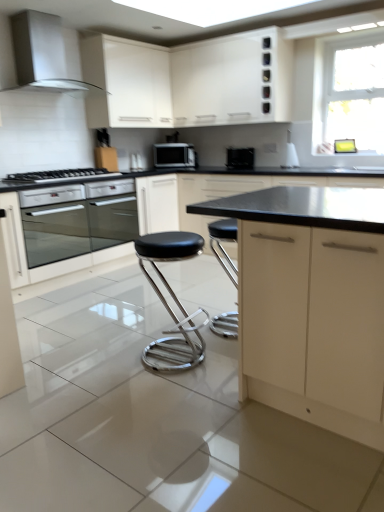
Question: Relative to black matte cabinet at center, positioned as the 2th cabinetry in bottom-to-top order, is satin silver range hood at upper left in front or behind?

Choices:
 (A) front
 (B) behind

Answer: (A)

Question: From the image's perspective, is satin silver range hood at upper left positioned above or below black matte cabinet at center, marked as the 3th cabinetry in a top-to-bottom arrangement?

Choices:
 (A) below
 (B) above

Answer: (B)

Question: Considering the real-world distances, which object is closest to the matte black microwave at center?

Choices:
 (A) satin silver range hood at upper left
 (B) black glossy toaster at center
 (C) satin silver oven at lower left
 (D) black stainless steel gas stove at left
 (E) matte cream cabinet at center, acting as the fourth cabinetry starting from the top

Answer: (B)

Question: Which is nearer to the satin silver range hood at upper left?

Choices:
 (A) matte cream cabinet at center, acting as the fourth cabinetry starting from the top
 (B) white matte cabinet at upper center, arranged as the fourth cabinetry when ordered from the bottom
 (C) black stainless steel gas stove at left
 (D) black leather stool at center
 (E) satin silver oven at lower left

Answer: (B)